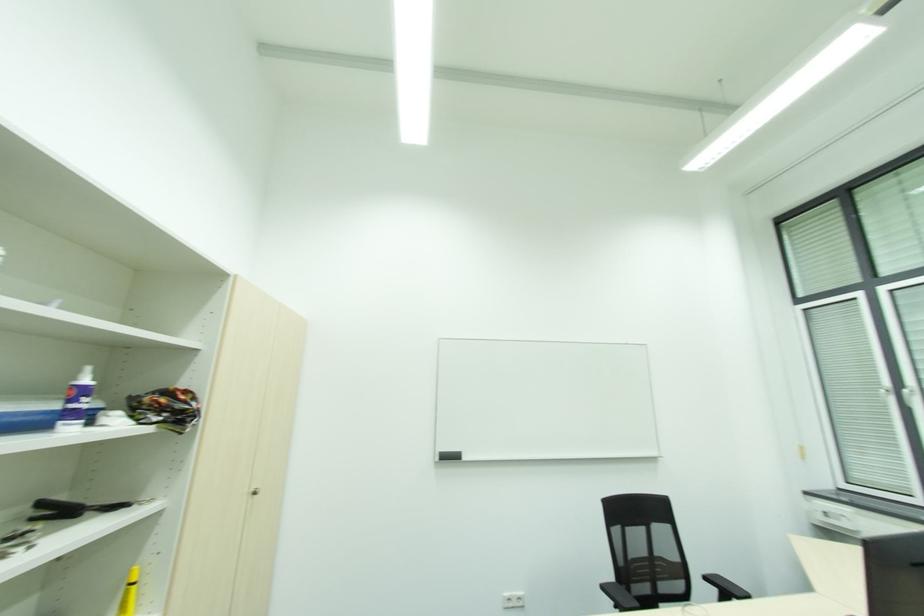
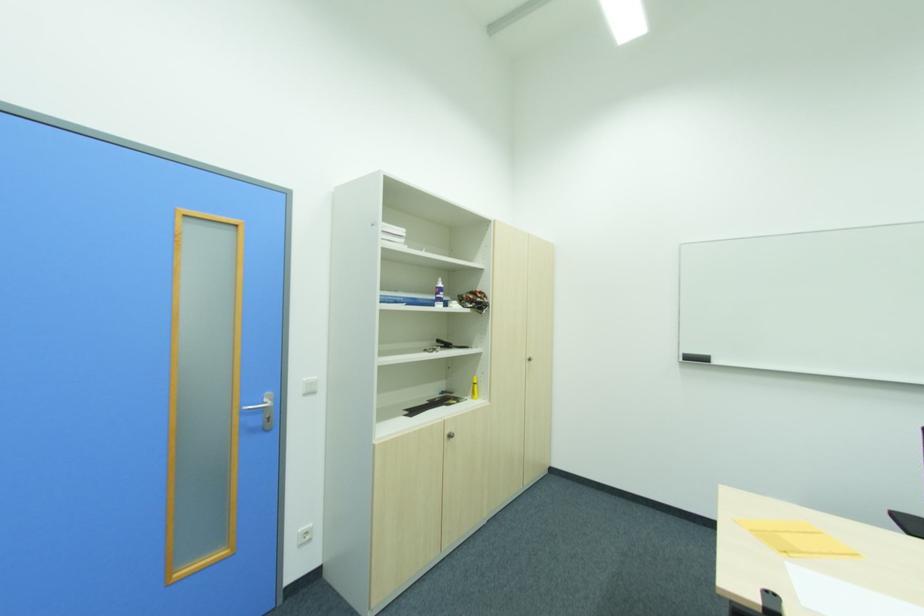
Question: How did the camera likely rotate?

Choices:
 (A) Left
 (B) Right
 (C) Up
 (D) Down

Answer: (A)